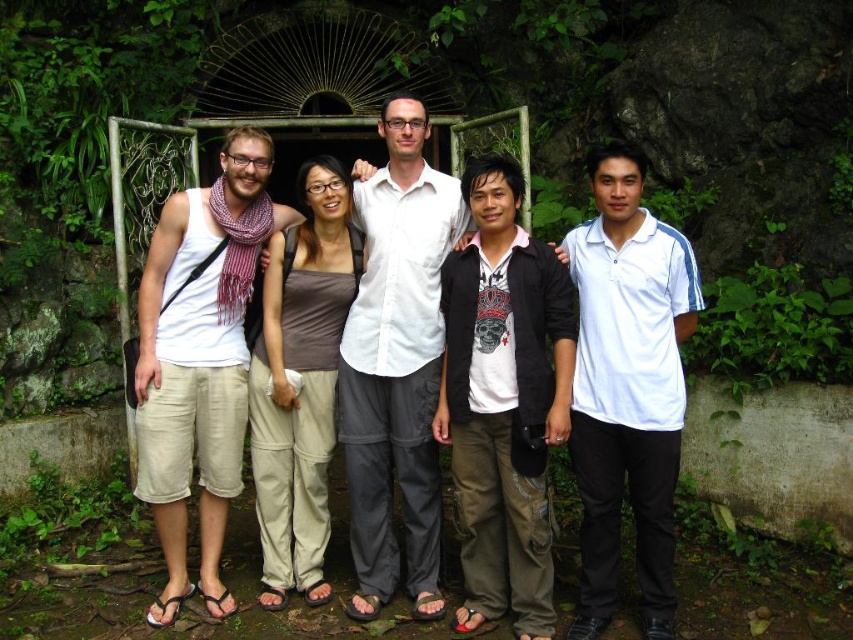
You are a photographer trying to adjust the lighting for a group photo. You notice the dark gray cotton shirt at center is positioned at coordinates 0.627, 0.591. Can you confirm if this placement aligns with the desired central focus of the image?

The dark gray cotton shirt at center is located at point (503, 401), which is near the center of the image, so it aligns with the desired central focus.

You are trying to locate the dark gray cotton shirt at center in a group photo taken in a garden. Based on the coordinates provided, where exactly would you look to find it?

The dark gray cotton shirt at center is located at point 0.627 on the horizontal axis and 0.591 on the vertical axis within the image frame.

You are a photographer trying to adjust the composition of the image. You notice the dark gray cotton shirt at center and the white cotton tank top at left. Which clothing item appears narrower in the photo?

The dark gray cotton shirt at center appears narrower compared to the white cotton tank top at left.